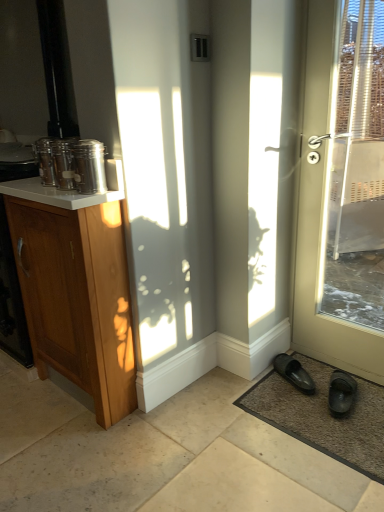
Image resolution: width=384 pixels, height=512 pixels. What are the coordinates of `vacant space in front of black rubber slipper at lower right, the second footwear viewed from the right` in the screenshot? It's located at (292, 407).